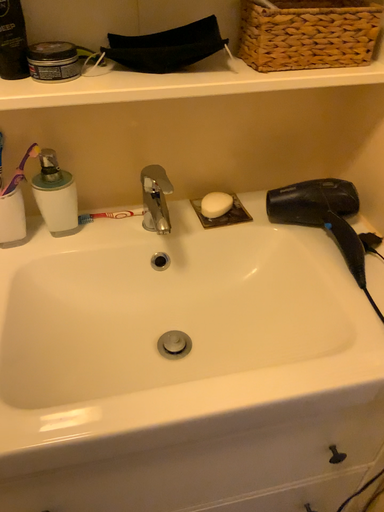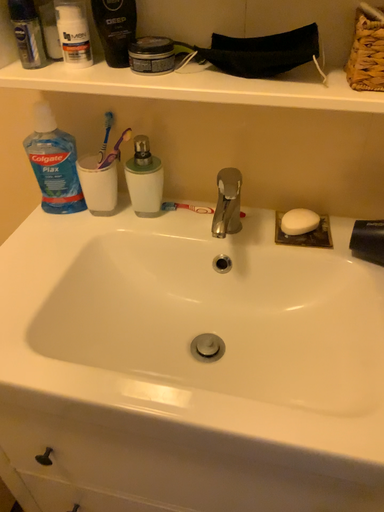
Question: How did the camera likely rotate when shooting the video?

Choices:
 (A) rotated right
 (B) rotated left

Answer: (B)